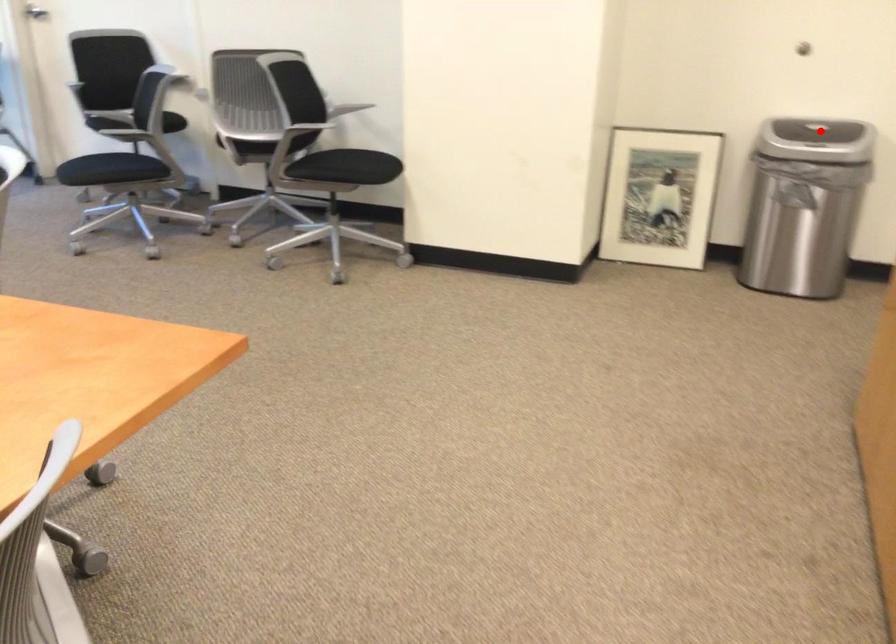
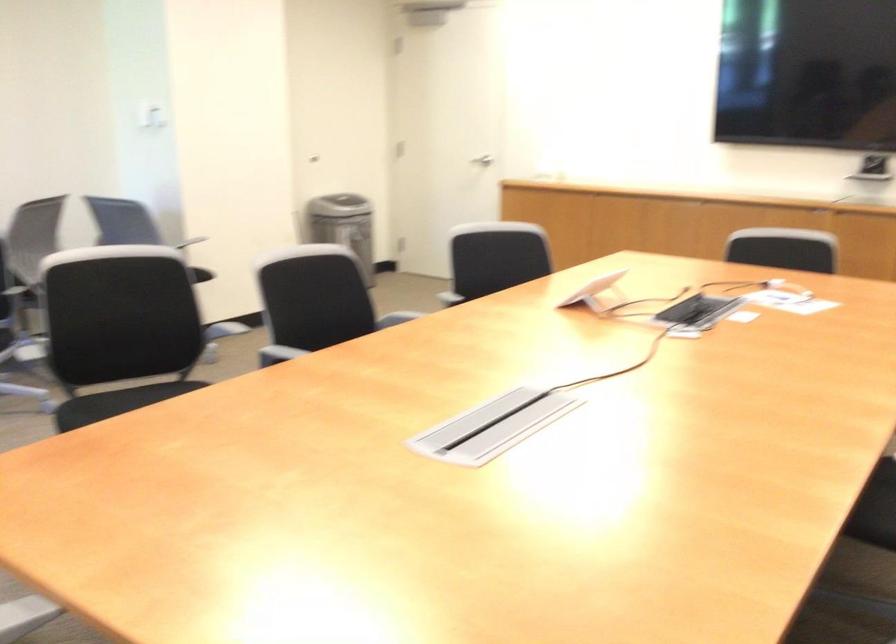
Question: I am providing you with two images of the same scene from different viewpoints. A red point is marked on the first image. Can you still see the location of the red point in image 2?

Choices:
 (A) Yes
 (B) No

Answer: (B)